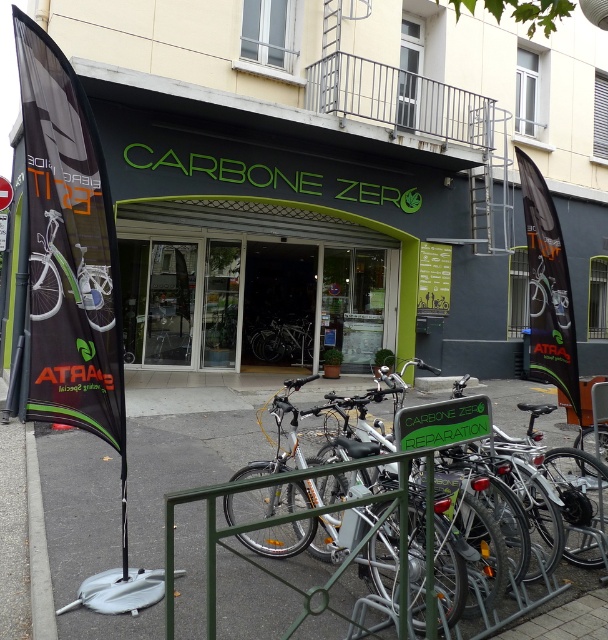
Question: Which of these objects is positioned farthest from the shiny silver bicycle at center?

Choices:
 (A) green matte storefront at center
 (B) gray concrete pavement at lower left

Answer: (B)

Question: Does gray concrete pavement at lower left have a lesser width compared to green matte storefront at center?

Choices:
 (A) yes
 (B) no

Answer: (A)

Question: Is gray concrete pavement at lower left positioned before shiny silver bicycle at center?

Choices:
 (A) no
 (B) yes

Answer: (B)

Question: Which of these objects is positioned farthest from the green matte storefront at center?

Choices:
 (A) shiny silver bicycle at center
 (B) gray concrete pavement at lower left

Answer: (B)

Question: Does green matte storefront at center have a smaller size compared to shiny silver bicycle at center?

Choices:
 (A) yes
 (B) no

Answer: (B)

Question: Which object is closer to the camera taking this photo?

Choices:
 (A) green matte storefront at center
 (B) gray concrete pavement at lower left

Answer: (B)